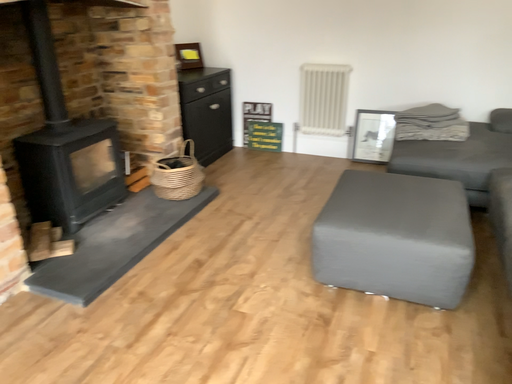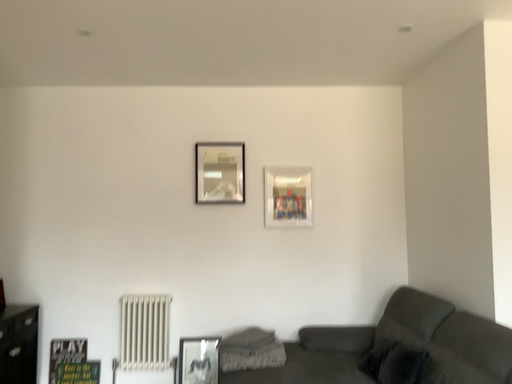
Question: Which way did the camera rotate in the video?

Choices:
 (A) rotated upward
 (B) rotated downward

Answer: (A)